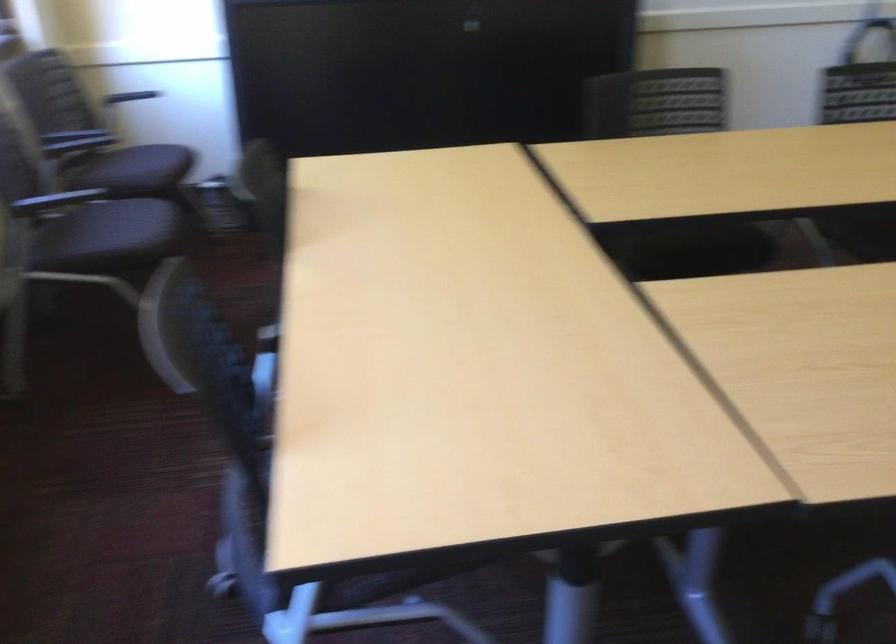
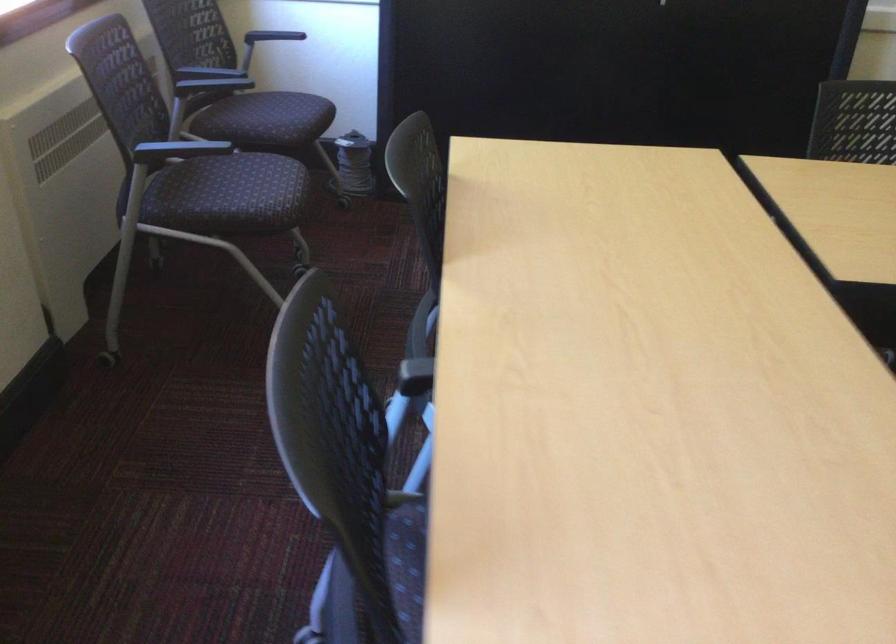
Question: The first image is from the beginning of the video and the second image is from the end. How did the camera likely rotate when shooting the video?

Choices:
 (A) Left
 (B) Right
 (C) Up
 (D) Down

Answer: (A)